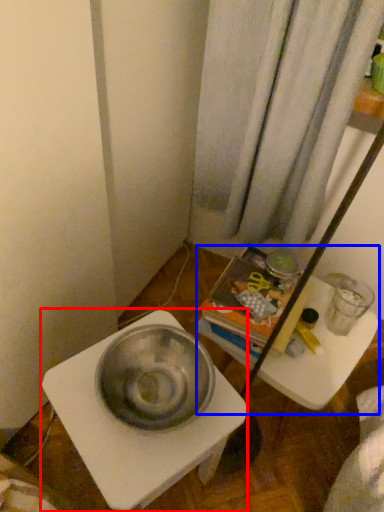
Question: Which object appears farthest to the camera in this image, table (highlighted by a red box) or vanity (highlighted by a blue box)?

Choices:
 (A) table
 (B) vanity

Answer: (B)